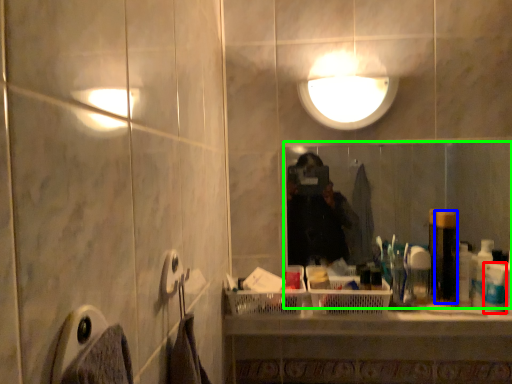
Question: Estimate the real-world distances between objects in this image. Which object is farther from toiletry (highlighted by a red box), toiletry (highlighted by a blue box) or mirror (highlighted by a green box)?

Choices:
 (A) toiletry
 (B) mirror

Answer: (B)